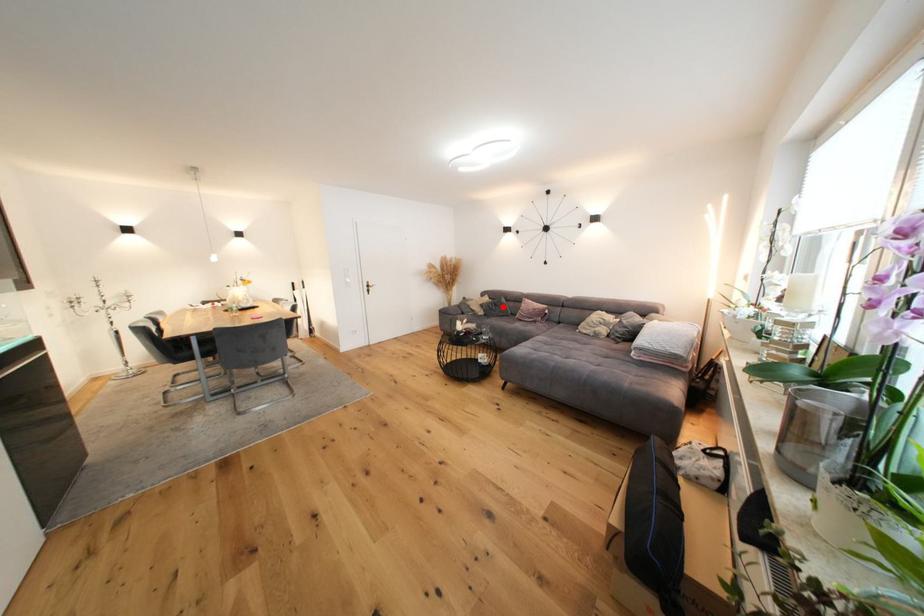
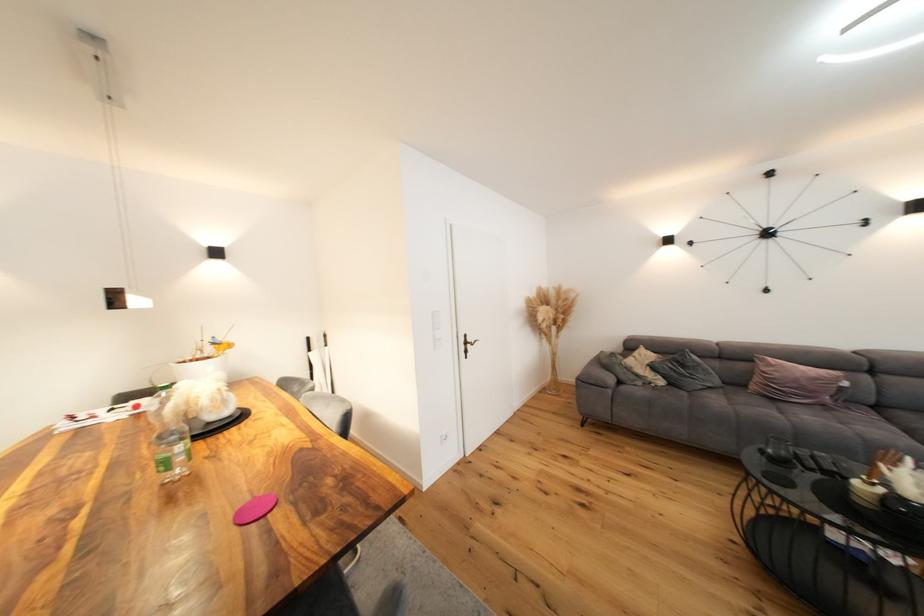
In the second image, find the point that corresponds to the highlighted location in the first image.

(690, 368)